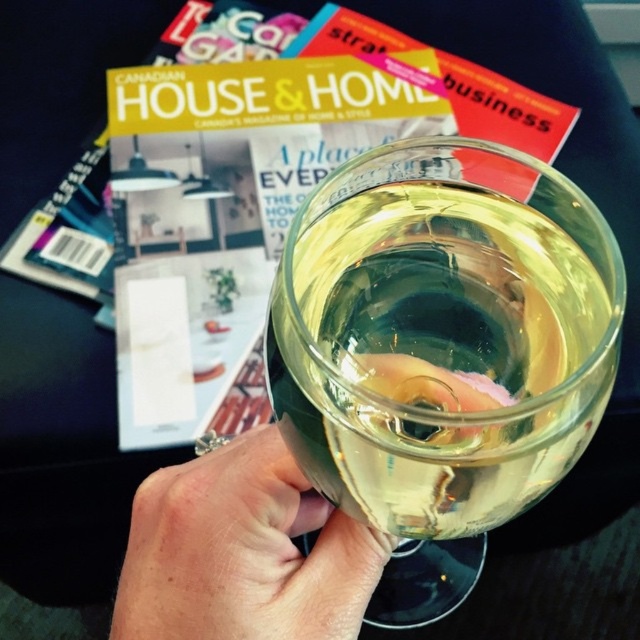
From the picture: What object is located at the coordinates point (243,552) in the image?

The point (243,552) indicates translucent glass at center.

You are a bartender preparing a drink and need to place two glasses on a narrow shelf that is 2 inches wide. You have the transparent glass at center and the translucent glass at center. Can both glasses fit side by side on the shelf without overlapping?

The transparent glass at center and translucent glass at center are 2.10 inches apart, so they cannot fit on a 2 inch wide shelf without overlapping since the required space is slightly larger than the shelf width.

You are a photographer trying to capture the reflection on the wine glass. You notice two points of light reflected in the glass at coordinates point (435,493) and point (250,604). Which point is closer to the camera?

Point (435,493) is in front of point (250,604), so it is closer to the camera.